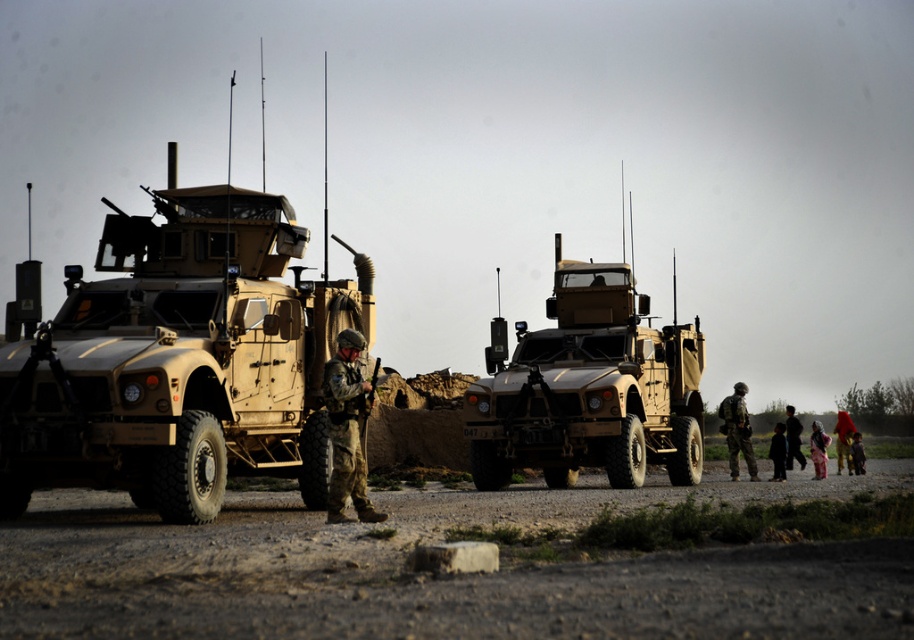
What are the coordinates of `camouflage fabric uniform at center` in the screenshot? It's located at (346, 429).

Which is more to the right, camouflage fabric uniform at center or camouflage uniform at center?

Positioned to the right is camouflage uniform at center.

Between point (335, 429) and point (725, 420), which one is positioned behind?

Point (725, 420)

The width and height of the screenshot is (914, 640). In order to click on camouflage fabric uniform at center in this screenshot , I will do `click(346, 429)`.

Is camouflage fabric uniform at center positioned at the back of camouflage uniform at right?

No, camouflage fabric uniform at center is closer to the viewer.

What do you see at coordinates (346, 429) in the screenshot?
I see `camouflage fabric uniform at center` at bounding box center [346, 429].

The width and height of the screenshot is (914, 640). Identify the location of camouflage fabric uniform at center. (346, 429).

Can you confirm if dark clothing at right is positioned below red fabric dress at lower right?

Incorrect, dark clothing at right is not positioned below red fabric dress at lower right.

The image size is (914, 640). What do you see at coordinates (778, 452) in the screenshot?
I see `dark clothing at right` at bounding box center [778, 452].

You are a GUI agent. You are given a task and a screenshot of the screen. Output one action in this format:
    pyautogui.click(x=<x>, y=<y>)
    Task: Click on the dark clothing at right
    The height and width of the screenshot is (640, 914).
    Given the screenshot: What is the action you would take?
    pyautogui.click(x=778, y=452)

In order to click on dark clothing at right in this screenshot , I will do `click(778, 452)`.